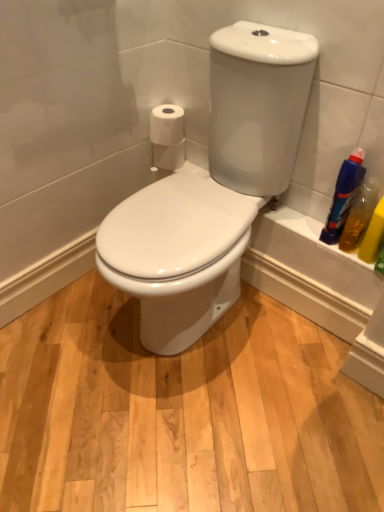
The width and height of the screenshot is (384, 512). Identify the location of white matte toilet paper at upper left, which ranks as the 1th toilet paper in bottom-to-top order. (169, 155).

Locate an element on the screen. The height and width of the screenshot is (512, 384). white matte toilet paper at upper right, the second toilet paper positioned from the bottom is located at coordinates (166, 124).

Measure the distance between point (266,119) and camera.

1.16 meters.

What do you see at coordinates (344, 196) in the screenshot?
I see `blue plastic bottle at right, the second cleaning product in the right-to-left sequence` at bounding box center [344, 196].

The height and width of the screenshot is (512, 384). Identify the location of yellow translucent bottle at right, which is counted as the 1th cleaning product, starting from the right. (360, 215).

This screenshot has width=384, height=512. Find the location of `white matte toilet paper at upper left, arranged as the second toilet paper when viewed from the top`. white matte toilet paper at upper left, arranged as the second toilet paper when viewed from the top is located at coordinates (169, 155).

How distant is white matte toilet paper at upper left, which ranks as the 1th toilet paper in bottom-to-top order, from yellow translucent bottle at right, which is counted as the 1th cleaning product, starting from the right?

They are 28.10 inches apart.

Looking at this image, based on their sizes in the image, would you say white matte toilet paper at upper left, arranged as the second toilet paper when viewed from the top, is bigger or smaller than yellow translucent bottle at right, acting as the second cleaning product starting from the left?

Clearly, white matte toilet paper at upper left, arranged as the second toilet paper when viewed from the top, is larger in size than yellow translucent bottle at right, acting as the second cleaning product starting from the left.

Is white matte toilet paper at upper left, arranged as the second toilet paper when viewed from the top, thinner than yellow translucent bottle at right, which is counted as the 1th cleaning product, starting from the right?

No.

Is point (178, 146) closer to viewer compared to point (341, 241)?

No.

Considering the positions of points (360, 215) and (334, 237), is point (360, 215) closer to camera compared to point (334, 237)?

Yes, point (360, 215) is in front of point (334, 237).

Between yellow translucent bottle at right, acting as the second cleaning product starting from the left, and blue plastic bottle at right, the second cleaning product in the right-to-left sequence, which one has more height?

With more height is blue plastic bottle at right, the second cleaning product in the right-to-left sequence.

Is blue plastic bottle at right, placed as the first cleaning product when sorted from left to right, located within yellow translucent bottle at right, acting as the second cleaning product starting from the left?

No, blue plastic bottle at right, placed as the first cleaning product when sorted from left to right, is located outside of yellow translucent bottle at right, acting as the second cleaning product starting from the left.

Between white matte toilet paper at upper right, the second toilet paper positioned from the bottom, and white glossy toilet at center, which one is positioned behind?

white matte toilet paper at upper right, the second toilet paper positioned from the bottom, is more distant.

From a real-world perspective, is white matte toilet paper at upper right, positioned as the 1th toilet paper in top-to-bottom order, on white glossy toilet at center?

Yes, from a real-world perspective, white matte toilet paper at upper right, positioned as the 1th toilet paper in top-to-bottom order, is over white glossy toilet at center

From the image's perspective, is white matte toilet paper at upper right, positioned as the 1th toilet paper in top-to-bottom order, located above or below white glossy toilet at center?

white matte toilet paper at upper right, positioned as the 1th toilet paper in top-to-bottom order, is situated higher than white glossy toilet at center in the image.

In the scene shown: Can you confirm if white matte toilet paper at upper right, the second toilet paper positioned from the bottom, is thinner than white glossy toilet at center?

Correct, the width of white matte toilet paper at upper right, the second toilet paper positioned from the bottom, is less than that of white glossy toilet at center.

Would you say yellow translucent bottle at right, which is counted as the 1th cleaning product, starting from the right, is to the left or to the right of white matte toilet paper at upper right, positioned as the 1th toilet paper in top-to-bottom order, in the picture?

In the image, yellow translucent bottle at right, which is counted as the 1th cleaning product, starting from the right, appears on the right side of white matte toilet paper at upper right, positioned as the 1th toilet paper in top-to-bottom order.

From the picture: Could you measure the distance between yellow translucent bottle at right, which is counted as the 1th cleaning product, starting from the right, and white matte toilet paper at upper right, the second toilet paper positioned from the bottom?

yellow translucent bottle at right, which is counted as the 1th cleaning product, starting from the right, is 28.69 inches from white matte toilet paper at upper right, the second toilet paper positioned from the bottom.

Who is shorter, yellow translucent bottle at right, which is counted as the 1th cleaning product, starting from the right, or white matte toilet paper at upper right, positioned as the 1th toilet paper in top-to-bottom order?

white matte toilet paper at upper right, positioned as the 1th toilet paper in top-to-bottom order, is shorter.

From the image's perspective, between yellow translucent bottle at right, acting as the second cleaning product starting from the left, and white matte toilet paper at upper right, the second toilet paper positioned from the bottom, which one is located above?

white matte toilet paper at upper right, the second toilet paper positioned from the bottom.

Measure the distance between white matte toilet paper at upper left, which ranks as the 1th toilet paper in bottom-to-top order, and blue plastic bottle at right, placed as the first cleaning product when sorted from left to right.

26.36 inches.

From the image's perspective, who appears lower, white matte toilet paper at upper left, which ranks as the 1th toilet paper in bottom-to-top order, or blue plastic bottle at right, the second cleaning product in the right-to-left sequence?

blue plastic bottle at right, the second cleaning product in the right-to-left sequence, is shown below in the image.

Would you consider white matte toilet paper at upper left, arranged as the second toilet paper when viewed from the top, to be distant from blue plastic bottle at right, the second cleaning product in the right-to-left sequence?

Actually, white matte toilet paper at upper left, arranged as the second toilet paper when viewed from the top, and blue plastic bottle at right, the second cleaning product in the right-to-left sequence, are a little close together.

Which object is closer to the camera, white matte toilet paper at upper left, arranged as the second toilet paper when viewed from the top, or blue plastic bottle at right, the second cleaning product in the right-to-left sequence?

Positioned in front is blue plastic bottle at right, the second cleaning product in the right-to-left sequence.

Does white glossy toilet at center lie behind yellow translucent bottle at right, which is counted as the 1th cleaning product, starting from the right?

No, the depth of white glossy toilet at center is less than that of yellow translucent bottle at right, which is counted as the 1th cleaning product, starting from the right.

From a real-world perspective, is white glossy toilet at center physically located above or below yellow translucent bottle at right, acting as the second cleaning product starting from the left?

white glossy toilet at center is below yellow translucent bottle at right, acting as the second cleaning product starting from the left.

Between white glossy toilet at center and yellow translucent bottle at right, which is counted as the 1th cleaning product, starting from the right, which one has smaller width?

With smaller width is yellow translucent bottle at right, which is counted as the 1th cleaning product, starting from the right.

From the image's perspective, is white glossy toilet at center under yellow translucent bottle at right, which is counted as the 1th cleaning product, starting from the right?

No, from the image's perspective, white glossy toilet at center is not below yellow translucent bottle at right, which is counted as the 1th cleaning product, starting from the right.

Is white glossy toilet at center completely or partially outside of white matte toilet paper at upper left, which ranks as the 1th toilet paper in bottom-to-top order?

Yes, white glossy toilet at center is not within white matte toilet paper at upper left, which ranks as the 1th toilet paper in bottom-to-top order.

Which is nearer, [178,319] or [158,154]?

Point [178,319] appears to be closer to the viewer than point [158,154].

From the image's perspective, is white glossy toilet at center below white matte toilet paper at upper left, arranged as the second toilet paper when viewed from the top?

Correct, white glossy toilet at center appears lower than white matte toilet paper at upper left, arranged as the second toilet paper when viewed from the top, in the image.

Which toilet paper is the 2nd one when counting from the left side of the yellow translucent bottle at right, acting as the second cleaning product starting from the left? Please provide its 2D coordinates.

[(169, 155)]

Locate an element on the screen. This screenshot has height=512, width=384. cleaning product that is below the blue plastic bottle at right, placed as the first cleaning product when sorted from left to right (from the image's perspective) is located at coordinates (360, 215).

Looking at the image, which one is located closer to white glossy toilet at center, yellow translucent bottle at right, acting as the second cleaning product starting from the left, or white matte toilet paper at upper left, which ranks as the 1th toilet paper in bottom-to-top order?

yellow translucent bottle at right, acting as the second cleaning product starting from the left, is positioned closer to the anchor white glossy toilet at center.

Looking at the image, which one is located further to white matte toilet paper at upper right, positioned as the 1th toilet paper in top-to-bottom order, blue plastic bottle at right, the second cleaning product in the right-to-left sequence, or white glossy toilet at center?

The object further to white matte toilet paper at upper right, positioned as the 1th toilet paper in top-to-bottom order, is blue plastic bottle at right, the second cleaning product in the right-to-left sequence.

Which object lies further to the anchor point blue plastic bottle at right, the second cleaning product in the right-to-left sequence, white matte toilet paper at upper right, positioned as the 1th toilet paper in top-to-bottom order, or white matte toilet paper at upper left, which ranks as the 1th toilet paper in bottom-to-top order?

Among the two, white matte toilet paper at upper right, positioned as the 1th toilet paper in top-to-bottom order, is located further to blue plastic bottle at right, the second cleaning product in the right-to-left sequence.

Looking at the image, which one is located further to blue plastic bottle at right, placed as the first cleaning product when sorted from left to right, white matte toilet paper at upper left, which ranks as the 1th toilet paper in bottom-to-top order, or white matte toilet paper at upper right, positioned as the 1th toilet paper in top-to-bottom order?

Among the two, white matte toilet paper at upper right, positioned as the 1th toilet paper in top-to-bottom order, is located further to blue plastic bottle at right, placed as the first cleaning product when sorted from left to right.

Based on the photo, from the image, which object appears to be nearer to white glossy toilet at center, blue plastic bottle at right, the second cleaning product in the right-to-left sequence, or white matte toilet paper at upper right, positioned as the 1th toilet paper in top-to-bottom order?

blue plastic bottle at right, the second cleaning product in the right-to-left sequence, is closer to white glossy toilet at center.

When comparing their distances from white matte toilet paper at upper left, arranged as the second toilet paper when viewed from the top, does white glossy toilet at center or blue plastic bottle at right, placed as the first cleaning product when sorted from left to right, seem closer?

white glossy toilet at center lies closer to white matte toilet paper at upper left, arranged as the second toilet paper when viewed from the top, than the other object.

Considering their positions, is white matte toilet paper at upper right, positioned as the 1th toilet paper in top-to-bottom order, positioned further to blue plastic bottle at right, the second cleaning product in the right-to-left sequence, than yellow translucent bottle at right, which is counted as the 1th cleaning product, starting from the right?

Among the two, white matte toilet paper at upper right, positioned as the 1th toilet paper in top-to-bottom order, is located further to blue plastic bottle at right, the second cleaning product in the right-to-left sequence.

From the picture: Estimate the real-world distances between objects in this image. Which object is closer to blue plastic bottle at right, placed as the first cleaning product when sorted from left to right, white glossy toilet at center or white matte toilet paper at upper right, the second toilet paper positioned from the bottom?

white glossy toilet at center is closer to blue plastic bottle at right, placed as the first cleaning product when sorted from left to right.

You are a GUI agent. You are given a task and a screenshot of the screen. Output one action in this format:
    pyautogui.click(x=<x>, y=<y>)
    Task: Click on the cleaning product located between white glossy toilet at center and yellow translucent bottle at right, acting as the second cleaning product starting from the left, in the left-right direction
    The width and height of the screenshot is (384, 512).
    Given the screenshot: What is the action you would take?
    pyautogui.click(x=344, y=196)

Find the location of a particular element. The height and width of the screenshot is (512, 384). toilet paper between white matte toilet paper at upper left, which ranks as the 1th toilet paper in bottom-to-top order, and yellow translucent bottle at right, which is counted as the 1th cleaning product, starting from the right, from left to right is located at coordinates (166, 124).

You are a GUI agent. You are given a task and a screenshot of the screen. Output one action in this format:
    pyautogui.click(x=<x>, y=<y>)
    Task: Click on the toilet paper between white matte toilet paper at upper left, which ranks as the 1th toilet paper in bottom-to-top order, and blue plastic bottle at right, the second cleaning product in the right-to-left sequence, in the horizontal direction
    The height and width of the screenshot is (512, 384).
    Given the screenshot: What is the action you would take?
    pyautogui.click(x=166, y=124)

The image size is (384, 512). In order to click on cleaning product between white matte toilet paper at upper right, the second toilet paper positioned from the bottom, and yellow translucent bottle at right, acting as the second cleaning product starting from the left, from left to right in this screenshot , I will do `click(344, 196)`.